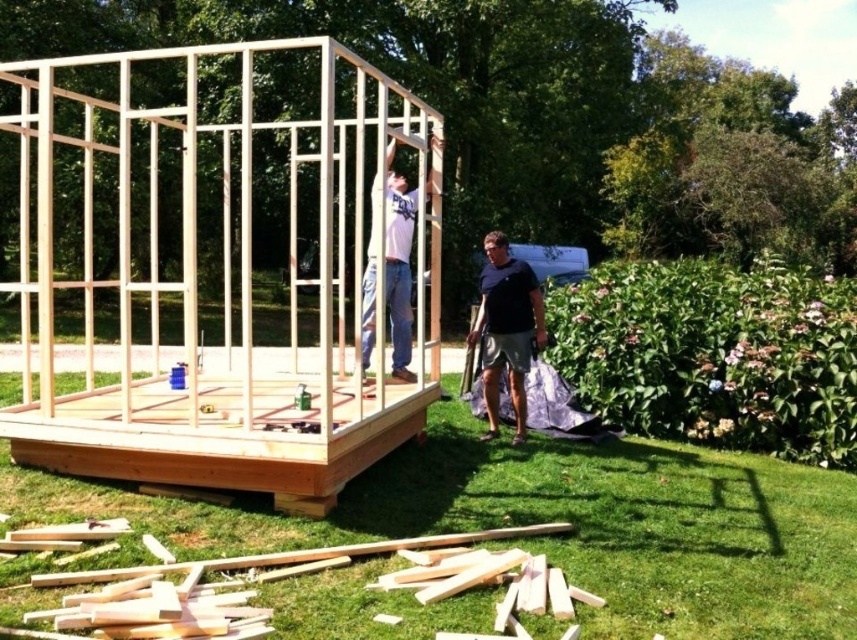
Between natural wood shed at center and black cotton shirt at center, which one appears on the left side from the viewer's perspective?

natural wood shed at center

Does natural wood shed at center have a lesser height compared to black cotton shirt at center?

No, natural wood shed at center is not shorter than black cotton shirt at center.

Find the location of `natural wood shed at center`. natural wood shed at center is located at coordinates (225, 292).

This screenshot has height=640, width=857. Identify the location of natural wood shed at center. (225, 292).

Which is in front, point (441, 586) or point (370, 332)?

Point (441, 586) is more forward.

Is point (148, 611) closer to camera compared to point (396, 252)?

Yes, point (148, 611) is closer to viewer.

Does point (415, 582) come farther from viewer compared to point (373, 227)?

No, it is not.

Image resolution: width=857 pixels, height=640 pixels. In order to click on light brown wood at lower left in this screenshot , I will do `click(283, 576)`.

The height and width of the screenshot is (640, 857). What are the coordinates of `black cotton shirt at center` in the screenshot? It's located at (506, 330).

Where is `black cotton shirt at center`? black cotton shirt at center is located at coordinates (506, 330).